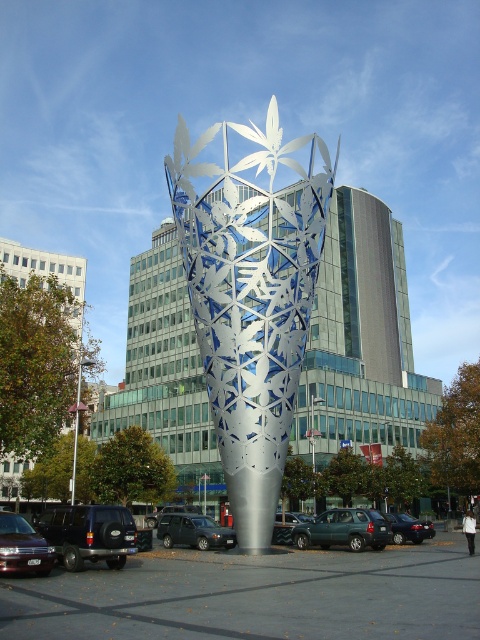
Consider the image. You are a photographer trying to capture the silver metallic sculpture at center and the black matte suv at lower left in the same frame. However, the sculpture is blocking the view of the suv. Can you adjust your position to see both objects clearly?

The silver metallic sculpture at center is positioned over the black matte suv at lower left, so moving to a lower angle or shifting your position to the side might allow you to see both the sculpture and the suv without obstruction.

You are a delivery driver who needs to park your black matte suv at lower left near the silver metallic sculpture at center. The parking space available is 20 meters long. Can your suv fit in the parking space if you drive directly towards the sculpture?

The distance between the silver metallic sculpture at center and the black matte suv at lower left is 19.98 meters. Since the parking space is 20 meters long, the suv can fit as the distance is just under the limit.

You are a delivery driver who needs to park your dark gray metallic suv at center in the metallic gray parking lot at center. Can your suv fit into the parking space?

The metallic gray parking lot at center is wider than the dark gray metallic suv at center, so yes, the suv can fit into the parking space.